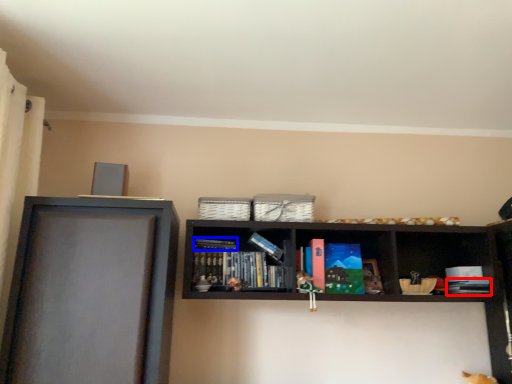
Question: Which object is closer to the camera taking this photo, book (highlighted by a red box) or book (highlighted by a blue box)?

Choices:
 (A) book
 (B) book

Answer: (A)